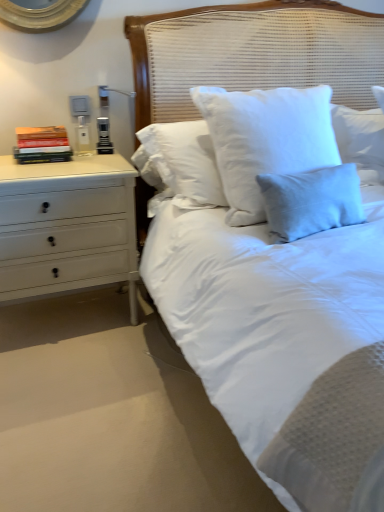
Locate an element on the screen. Image resolution: width=384 pixels, height=512 pixels. free space above white painted wood chest of drawers at left (from a real-world perspective) is located at coordinates (53, 163).